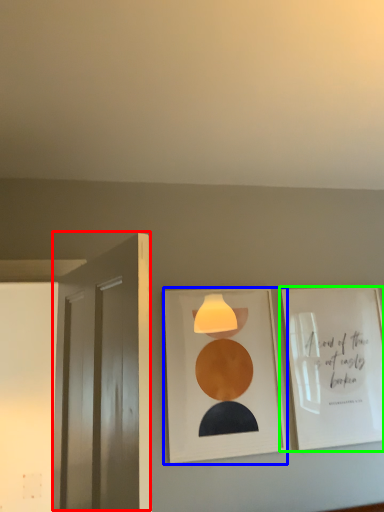
Question: Based on their relative distances, which object is nearer to door (highlighted by a red box)? Choose from picture frame (highlighted by a blue box) and picture frame (highlighted by a green box).

Choices:
 (A) picture frame
 (B) picture frame

Answer: (A)